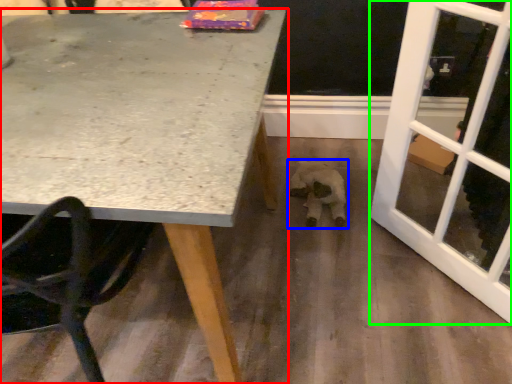
Question: Which object is the closest to the table (highlighted by a red box)? Choose among these: animal (highlighted by a blue box) or screen door (highlighted by a green box).

Choices:
 (A) animal
 (B) screen door

Answer: (B)